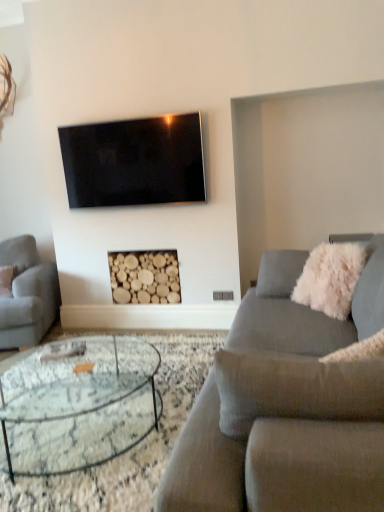
Question: Is natural wood logs at center shorter than black glossy tv at upper center?

Choices:
 (A) yes
 (B) no

Answer: (A)

Question: Considering the relative sizes of natural wood logs at center and black glossy tv at upper center in the image provided, is natural wood logs at center smaller than black glossy tv at upper center?

Choices:
 (A) yes
 (B) no

Answer: (B)

Question: Is black glossy tv at upper center inside natural wood logs at center?

Choices:
 (A) no
 (B) yes

Answer: (A)

Question: Is natural wood logs at center positioned in front of black glossy tv at upper center?

Choices:
 (A) no
 (B) yes

Answer: (A)

Question: Is natural wood logs at center to the left of black glossy tv at upper center from the viewer's perspective?

Choices:
 (A) no
 (B) yes

Answer: (A)

Question: Does point (46, 311) appear closer or farther from the camera than point (297, 282)?

Choices:
 (A) farther
 (B) closer

Answer: (A)

Question: Choose the correct answer: Is light gray fabric couch at left, the first studio couch when ordered from back to front, inside white fluffy pillow at right or outside it?

Choices:
 (A) outside
 (B) inside

Answer: (A)

Question: Looking at the image, does light gray fabric couch at left, which is the 1th studio couch in left-to-right order, seem bigger or smaller compared to white fluffy pillow at right?

Choices:
 (A) big
 (B) small

Answer: (A)

Question: Visually, is light gray fabric couch at left, marked as the second studio couch in a right-to-left arrangement, positioned to the left or to the right of white fluffy pillow at right?

Choices:
 (A) left
 (B) right

Answer: (A)

Question: From a real-world perspective, relative to textured gray couch at center, acting as the 2th studio couch starting from the left, is light gray fabric couch at left, marked as the second studio couch in a right-to-left arrangement, vertically above or below?

Choices:
 (A) below
 (B) above

Answer: (B)

Question: Looking at their shapes, would you say light gray fabric couch at left, the first studio couch when ordered from back to front, is wider or thinner than textured gray couch at center, acting as the 2th studio couch starting from the left?

Choices:
 (A) thin
 (B) wide

Answer: (A)

Question: From the image's perspective, relative to textured gray couch at center, acting as the 2th studio couch starting from the left, is light gray fabric couch at left, arranged as the 2th studio couch when viewed from the front, above or below?

Choices:
 (A) above
 (B) below

Answer: (A)

Question: In the image, is light gray fabric couch at left, arranged as the 2th studio couch when viewed from the front, on the left side or the right side of textured gray couch at center, acting as the 2th studio couch starting from the left?

Choices:
 (A) right
 (B) left

Answer: (B)

Question: From a real-world perspective, is textured gray couch at center, which is counted as the 1th studio couch, starting from the front, physically located above or below white fluffy pillow at right?

Choices:
 (A) above
 (B) below

Answer: (B)

Question: Is point (268, 327) positioned closer to the camera than point (302, 275)?

Choices:
 (A) closer
 (B) farther

Answer: (A)